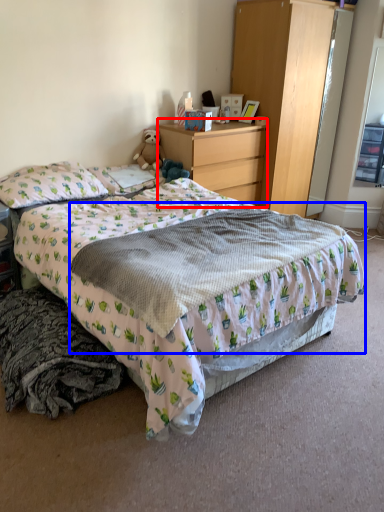
Question: Which of the following is the closest to the observer, desk (highlighted by a red box) or blanket (highlighted by a blue box)?

Choices:
 (A) desk
 (B) blanket

Answer: (B)